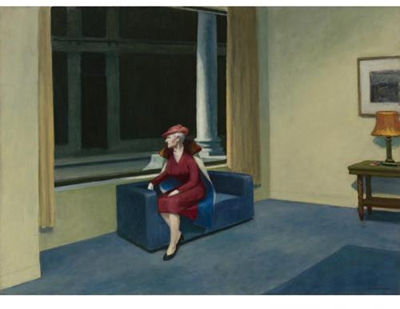
Identify the location of column. (207, 73).